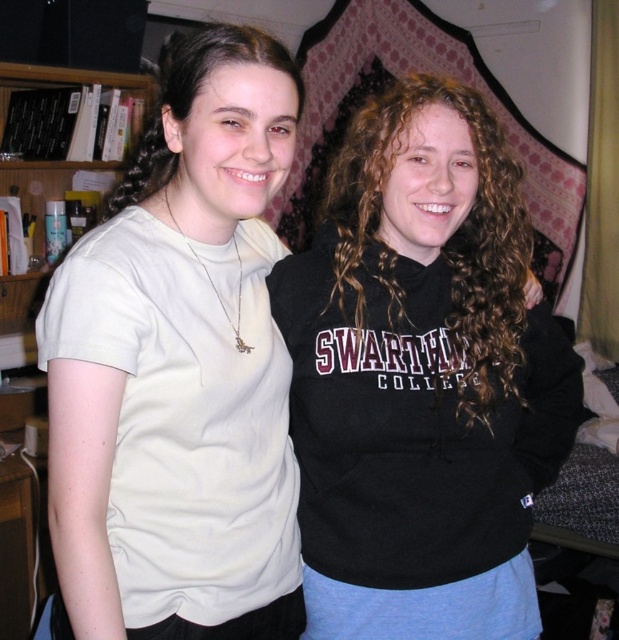
Question: Which point is closer to the camera taking this photo?

Choices:
 (A) [457, 106]
 (B) [2, 304]

Answer: (A)

Question: Which point is farther from the camera taking this photo?

Choices:
 (A) (448, 316)
 (B) (412, 579)
 (C) (123, 196)
 (D) (20, 296)

Answer: (D)

Question: In this image, where is white matte t-shirt at left located relative to curly brown hair at center?

Choices:
 (A) right
 (B) left

Answer: (B)

Question: Which point is closer to the camera?

Choices:
 (A) black matte hoodie at right
 (B) curly brown hair at center

Answer: (A)

Question: Can you confirm if black matte hoodie at right is positioned to the left of brownhair at left?

Choices:
 (A) yes
 (B) no

Answer: (B)

Question: Is white matte t-shirt at left to the right of curly brown hair at center from the viewer's perspective?

Choices:
 (A) no
 (B) yes

Answer: (A)